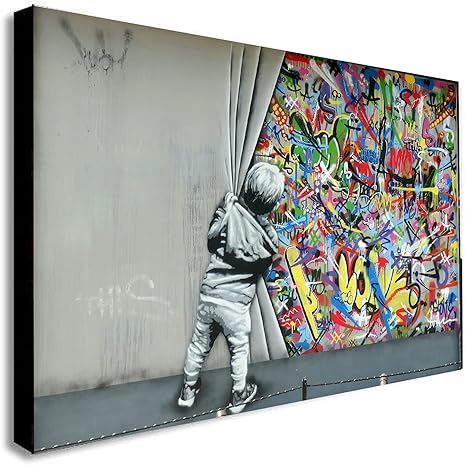
The image size is (466, 465). I want to click on wall covered in graffiti, so click(364, 220).